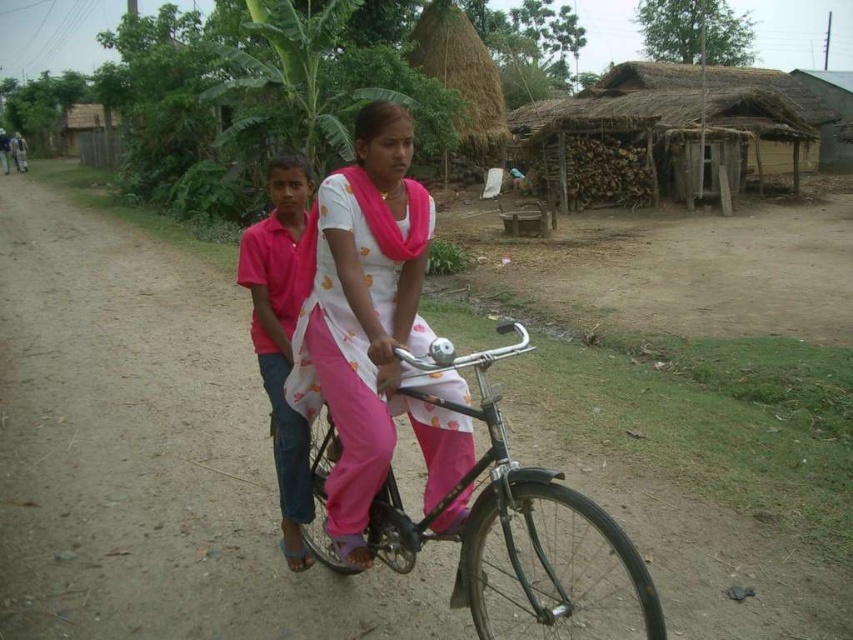
You are a photographer planning to take a photo of the metallic silver bicycle at center and the thatched roof hut at upper right. Based on their sizes in the image, which object should you focus on first if you want to ensure both are in sharp focus?

The thatched roof hut at upper right is much taller than the metallic silver bicycle at center, so you should focus on the thatched roof hut at upper right first to ensure both are in sharp focus since it is larger and might require more precise focusing.

You are navigating a drone over a rural area and need to land it precisely on the brown dirt track at center. What are the coordinates you should input for the landing zone?

The coordinates for the brown dirt track at center are 0.706 in the x direction and 0.178 in the y direction.

Based on the scene, can you determine if the pink satin dress at center is located closer to the ground than the thatched roof hut at upper right?

The pink satin dress at center is positioned under thatched roof hut at upper right, so yes, it is closer to the ground than the thatched roof hut at upper right.